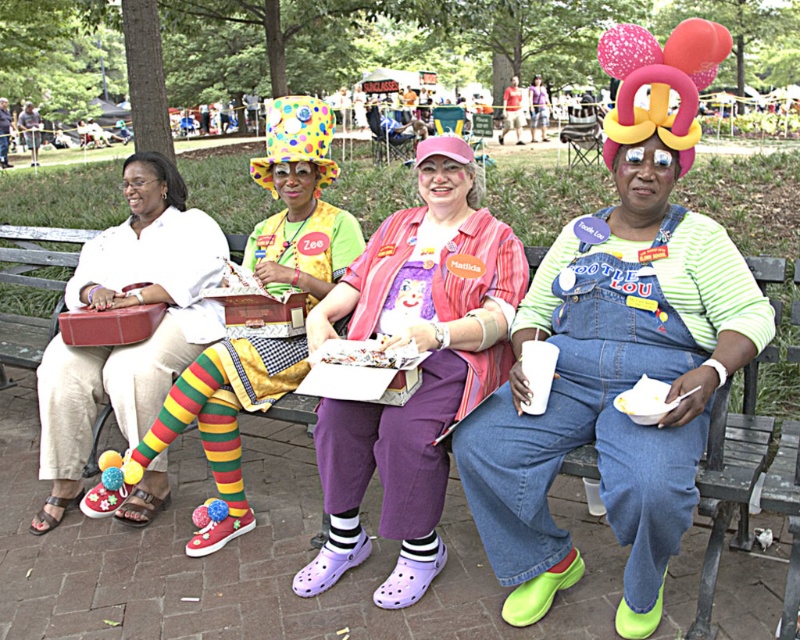
Between wooden bench at center and pink fabric dress at center, which one is positioned lower?

Positioned lower is wooden bench at center.

Who is positioned more to the right, wooden bench at center or pink fabric dress at center?

pink fabric dress at center is more to the right.

Who is more forward, (560, 636) or (432, 294)?

Point (560, 636) is more forward.

Where is `wooden bench at center`? The height and width of the screenshot is (640, 800). wooden bench at center is located at coordinates (258, 554).

Is the position of denim overalls at center more distant than that of pink fabric dress at center?

No, it is not.

Is point (624, 316) closer to camera compared to point (337, 483)?

Yes, point (624, 316) is in front of point (337, 483).

In order to click on denim overalls at center in this screenshot , I will do `click(612, 388)`.

Between wooden bench at center and beige fabric purse at left, which one appears on the right side from the viewer's perspective?

Positioned to the right is wooden bench at center.

Who is higher up, wooden bench at center or beige fabric purse at left?

Positioned higher is beige fabric purse at left.

Where is `wooden bench at center`? wooden bench at center is located at coordinates (258, 554).